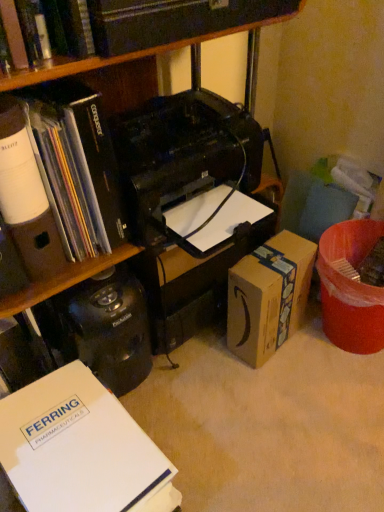
Where is `hardcover book at upper center, which is counted as the 3th book, starting from the bottom`? This screenshot has height=512, width=384. hardcover book at upper center, which is counted as the 3th book, starting from the bottom is located at coordinates (98, 56).

Consider the image. Measure the distance between hardcover book at upper center, the 1th book viewed from the top, and camera.

A distance of 21.53 inches exists between hardcover book at upper center, the 1th book viewed from the top, and camera.

Describe the element at coordinates (130, 54) in the screenshot. This screenshot has height=512, width=384. I see `black matte bookcase at upper left` at that location.

Find the location of a particular element. The width and height of the screenshot is (384, 512). white paper at lower left, the 1th book positioned from the bottom is located at coordinates (80, 449).

This screenshot has height=512, width=384. I want to click on brown cardboard box at lower right, so click(268, 296).

From a real-world perspective, is black matte bookcase at upper left below hardcover book at upper center, the 1th book viewed from the top?

Indeed, from a real-world perspective, black matte bookcase at upper left is positioned beneath hardcover book at upper center, the 1th book viewed from the top.

Which object is wider, black matte bookcase at upper left or hardcover book at upper center, the 1th book viewed from the top?

With larger width is black matte bookcase at upper left.

How different are the orientations of black matte bookcase at upper left and hardcover book at upper center, the 1th book viewed from the top, in degrees?

black matte bookcase at upper left and hardcover book at upper center, the 1th book viewed from the top, are facing 1.76 degrees away from each other.

Relative to hardcover book at upper center, the 1th book viewed from the top, is black matte bookcase at upper left in front or behind?

Visually, black matte bookcase at upper left is located behind hardcover book at upper center, the 1th book viewed from the top.

Looking at this image, is black matte bookcase at upper left completely or partially inside white paper at lower left, the 1th book positioned from the bottom?

That's incorrect, black matte bookcase at upper left is not inside white paper at lower left, the 1th book positioned from the bottom.

Which object is wider, white paper at lower left, the 1th book positioned from the bottom, or black matte bookcase at upper left?

black matte bookcase at upper left is wider.

From a real-world perspective, is white paper at lower left, arranged as the 3th book when viewed from the top, located beneath black matte bookcase at upper left?

Yes, from a real-world perspective, white paper at lower left, arranged as the 3th book when viewed from the top, is beneath black matte bookcase at upper left.

At what (x,y) coordinates should I click in order to perform the action: click on bookcase on the right of white paper at lower left, the 1th book positioned from the bottom. Please return your answer as a coordinate pair (x, y). Image resolution: width=384 pixels, height=512 pixels. Looking at the image, I should click on (130, 54).

From the image's perspective, is hardcover book at upper center, which is counted as the 3th book, starting from the bottom, beneath black matte bookcase at upper left?

No, from the image's perspective, hardcover book at upper center, which is counted as the 3th book, starting from the bottom, is not below black matte bookcase at upper left.

This screenshot has height=512, width=384. In order to click on the 1st book to the left of the black matte bookcase at upper left, counting from the anchor's position in this screenshot , I will do [x=98, y=56].

Is hardcover book at upper center, the 1th book viewed from the top, positioned in front of black matte bookcase at upper left?

Yes, it is.

Does hardcover book at upper center, the 1th book viewed from the top, have a greater width compared to black matte bookcase at upper left?

No, hardcover book at upper center, the 1th book viewed from the top, is not wider than black matte bookcase at upper left.

Which of these two, brown cardboard box at lower right or matte black book at left, acting as the second book starting from the bottom, is bigger?

Bigger between the two is matte black book at left, acting as the second book starting from the bottom.

From the image's perspective, starting from the brown cardboard box at lower right, which book is the 1st one above? Please provide its 2D coordinates.

[(78, 165)]

From the picture: Which of these two, brown cardboard box at lower right or matte black book at left, arranged as the 2th book when viewed from the top, is wider?

matte black book at left, arranged as the 2th book when viewed from the top.

Identify the location of the 1st book counting from the left of the hardcover book at upper center, which is counted as the 3th book, starting from the bottom. (80, 449).

Does white paper at lower left, the 1th book positioned from the bottom, have a lesser height compared to hardcover book at upper center, which is counted as the 3th book, starting from the bottom?

No.

Is white paper at lower left, arranged as the 3th book when viewed from the top, smaller than hardcover book at upper center, the 1th book viewed from the top?

Actually, white paper at lower left, arranged as the 3th book when viewed from the top, might be larger than hardcover book at upper center, the 1th book viewed from the top.

Is white paper at lower left, arranged as the 3th book when viewed from the top, positioned with its back to hardcover book at upper center, which is counted as the 3th book, starting from the bottom?

No, white paper at lower left, arranged as the 3th book when viewed from the top, is not facing away from hardcover book at upper center, which is counted as the 3th book, starting from the bottom.

Considering the points (89, 87) and (267, 359), which point is in front, point (89, 87) or point (267, 359)?

Point (89, 87)

You are a GUI agent. You are given a task and a screenshot of the screen. Output one action in this format:
    pyautogui.click(x=<x>, y=<y>)
    Task: Click on the 3rd book to the left of the brown cardboard box at lower right, counting from the anchor's position
    
    Given the screenshot: What is the action you would take?
    pyautogui.click(x=78, y=165)

Is matte black book at left, acting as the second book starting from the bottom, surrounding brown cardboard box at lower right?

No, brown cardboard box at lower right is not a part of matte black book at left, acting as the second book starting from the bottom.

Considering the sizes of objects matte black book at left, acting as the second book starting from the bottom, and brown cardboard box at lower right in the image provided, who is taller, matte black book at left, acting as the second book starting from the bottom, or brown cardboard box at lower right?

matte black book at left, acting as the second book starting from the bottom, is taller.

Is point (234, 339) positioned in front of point (13, 77)?

No.

From a real-world perspective, which is physically below, brown cardboard box at lower right or hardcover book at upper center, the 1th book viewed from the top?

brown cardboard box at lower right.

At what (x,y) coordinates should I click in order to perform the action: click on book that is the 1st object to the left of the brown cardboard box at lower right, starting at the anchor. Please return your answer as a coordinate pair (x, y). Looking at the image, I should click on [98, 56].

The image size is (384, 512). I want to click on bookcase below the hardcover book at upper center, the 1th book viewed from the top (from a real-world perspective), so click(130, 54).

Where is `bookcase above the white paper at lower left, arranged as the 3th book when viewed from the top (from the image's perspective)`? This screenshot has width=384, height=512. bookcase above the white paper at lower left, arranged as the 3th book when viewed from the top (from the image's perspective) is located at coordinates (130, 54).

Estimate the real-world distances between objects in this image. Which object is further from hardcover book at upper center, the 1th book viewed from the top, matte black book at left, acting as the second book starting from the bottom, or brown cardboard box at lower right?

brown cardboard box at lower right lies further to hardcover book at upper center, the 1th book viewed from the top, than the other object.

Considering their positions, is brown cardboard box at lower right positioned closer to black matte bookcase at upper left than hardcover book at upper center, which is counted as the 3th book, starting from the bottom?

hardcover book at upper center, which is counted as the 3th book, starting from the bottom, is positioned closer to the anchor black matte bookcase at upper left.

Estimate the real-world distances between objects in this image. Which object is further from white paper at lower left, the 1th book positioned from the bottom, hardcover book at upper center, which is counted as the 3th book, starting from the bottom, or black matte bookcase at upper left?

The object further to white paper at lower left, the 1th book positioned from the bottom, is black matte bookcase at upper left.

When comparing their distances from matte black book at left, acting as the second book starting from the bottom, does white paper at lower left, arranged as the 3th book when viewed from the top, or hardcover book at upper center, the 1th book viewed from the top, seem further?

white paper at lower left, arranged as the 3th book when viewed from the top, is positioned further to the anchor matte black book at left, acting as the second book starting from the bottom.

From the picture: Considering their positions, is white paper at lower left, the 1th book positioned from the bottom, positioned further to brown cardboard box at lower right than black matte bookcase at upper left?

black matte bookcase at upper left.

Estimate the real-world distances between objects in this image. Which object is further from hardcover book at upper center, the 1th book viewed from the top, white paper at lower left, the 1th book positioned from the bottom, or brown cardboard box at lower right?

Based on the image, brown cardboard box at lower right appears to be further to hardcover book at upper center, the 1th book viewed from the top.

Which object lies further to the anchor point matte black book at left, acting as the second book starting from the bottom, black matte bookcase at upper left or hardcover book at upper center, which is counted as the 3th book, starting from the bottom?

Based on the image, black matte bookcase at upper left appears to be further to matte black book at left, acting as the second book starting from the bottom.

Which object lies nearer to the anchor point brown cardboard box at lower right, black matte bookcase at upper left or matte black book at left, arranged as the 2th book when viewed from the top?

The object closer to brown cardboard box at lower right is matte black book at left, arranged as the 2th book when viewed from the top.

Identify the location of box between matte black book at left, arranged as the 2th book when viewed from the top, and white paper at lower left, the 1th book positioned from the bottom, in the vertical direction. Image resolution: width=384 pixels, height=512 pixels. (268, 296).

What are the coordinates of `bookcase between hardcover book at upper center, which is counted as the 3th book, starting from the bottom, and matte black book at left, acting as the second book starting from the bottom, in the up-down direction` in the screenshot? It's located at (130, 54).

Find the location of a particular element. The height and width of the screenshot is (512, 384). box between hardcover book at upper center, the 1th book viewed from the top, and white paper at lower left, arranged as the 3th book when viewed from the top, in the vertical direction is located at coordinates (268, 296).

This screenshot has height=512, width=384. Identify the location of bookcase between hardcover book at upper center, the 1th book viewed from the top, and brown cardboard box at lower right from top to bottom. (130, 54).